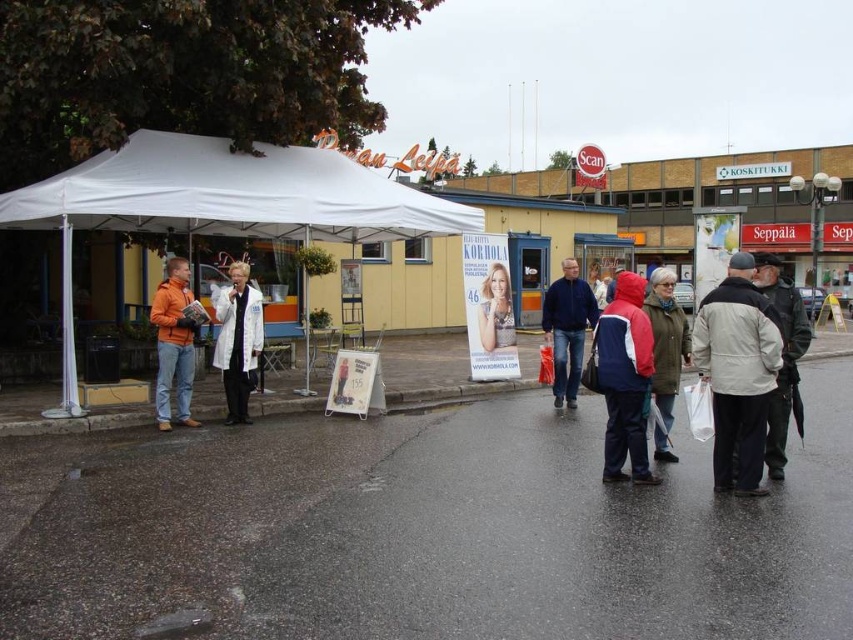
Is red and blue jacket at center closer to camera compared to smooth beige poster at center?

That is True.

Measure the distance between red and blue jacket at center and smooth beige poster at center.

red and blue jacket at center is 18.92 feet from smooth beige poster at center.

What do you see at coordinates (625, 378) in the screenshot?
I see `red and blue jacket at center` at bounding box center [625, 378].

The image size is (853, 640). I want to click on red and blue jacket at center, so click(x=625, y=378).

Can you confirm if light beige jacket at lower right is positioned to the right of red and blue jacket at center?

Yes, light beige jacket at lower right is to the right of red and blue jacket at center.

Does point (698, 321) lie in front of point (625, 356)?

Yes, point (698, 321) is in front of point (625, 356).

Describe the element at coordinates (737, 372) in the screenshot. I see `light beige jacket at lower right` at that location.

Identify the location of light beige jacket at lower right. (737, 372).

In the scene shown: Is dark gray jacket at right positioned behind smooth beige poster at center?

No.

I want to click on dark gray jacket at right, so click(781, 355).